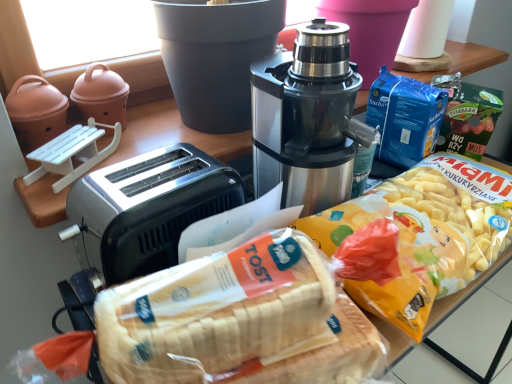
Question: In the image, is matte ceramic pot at upper left on the left side or the right side of satin black coffee maker at center?

Choices:
 (A) left
 (B) right

Answer: (A)

Question: From a real-world perspective, is matte ceramic pot at upper left above or below satin black coffee maker at center?

Choices:
 (A) above
 (B) below

Answer: (B)

Question: Based on their relative distances, which object is nearer to the satin silver toaster at left?

Choices:
 (A) white bread at center
 (B) satin black coffee maker at center
 (C) matte ceramic pot at upper left

Answer: (B)

Question: Which of these objects is positioned closest to the satin black coffee maker at center?

Choices:
 (A) white bread at center
 (B) matte ceramic pot at upper left
 (C) satin silver toaster at left

Answer: (C)